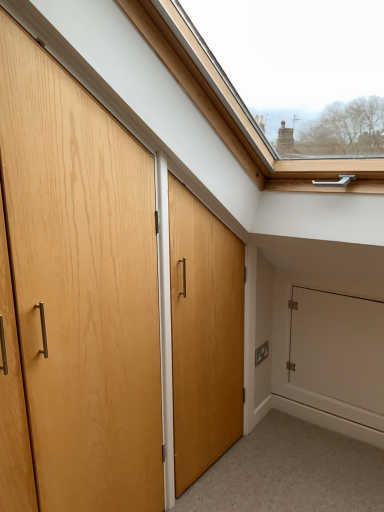
Describe the element at coordinates (337, 355) in the screenshot. I see `white matte door at lower right` at that location.

Image resolution: width=384 pixels, height=512 pixels. Identify the location of white matte door at lower right. (337, 355).

Describe the element at coordinates (81, 286) in the screenshot. I see `matte wood door at left` at that location.

This screenshot has height=512, width=384. In order to click on matte wood door at left in this screenshot , I will do `click(81, 286)`.

In order to click on white matte door at lower right in this screenshot , I will do `click(337, 355)`.

Is white matte door at lower right at the left side of matte wood door at left?

In fact, white matte door at lower right is to the right of matte wood door at left.

Between white matte door at lower right and matte wood door at left, which one is positioned behind?

white matte door at lower right.

Considering the points (306, 296) and (93, 364), which point is behind, point (306, 296) or point (93, 364)?

The point (306, 296) is farther.

From the image's perspective, between white matte door at lower right and matte wood door at left, who is located below?

white matte door at lower right appears lower in the image.

From a real-world perspective, is white matte door at lower right over matte wood door at left?

Actually, white matte door at lower right is physically below matte wood door at left in the real world.

Between white matte door at lower right and matte wood door at left, which one has larger width?

With larger width is matte wood door at left.

Between white matte door at lower right and matte wood door at left, which one has less height?

white matte door at lower right is shorter.

Considering the relative sizes of white matte door at lower right and matte wood door at left in the image provided, is white matte door at lower right bigger than matte wood door at left?

Actually, white matte door at lower right might be smaller than matte wood door at left.

Is white matte door at lower right surrounding matte wood door at left?

That's incorrect, matte wood door at left is not inside white matte door at lower right.

Is white matte door at lower right with matte wood door at left?

No, white matte door at lower right is not in contact with matte wood door at left.

Is white matte door at lower right facing towards matte wood door at left?

Yes, white matte door at lower right is oriented towards matte wood door at left.

Identify the location of screen door that is below the matte wood door at left (from the image's perspective). This screenshot has width=384, height=512. click(x=337, y=355).

In the scene shown: Would you say matte wood door at left is to the left or to the right of white matte door at lower right in the picture?

From the image, it's evident that matte wood door at left is to the left of white matte door at lower right.

Which object is closer to the camera, matte wood door at left or white matte door at lower right?

matte wood door at left is in front.

Which is in front, point (120, 291) or point (365, 355)?

The point (120, 291) is closer to the camera.

From the image's perspective, is matte wood door at left on top of white matte door at lower right?

Yes, from the image's perspective, matte wood door at left is above white matte door at lower right.

From a real-world perspective, who is located higher, matte wood door at left or white matte door at lower right?

matte wood door at left.

Considering the sizes of objects matte wood door at left and white matte door at lower right in the image provided, who is wider, matte wood door at left or white matte door at lower right?

matte wood door at left is wider.

Considering the relative sizes of matte wood door at left and white matte door at lower right in the image provided, is matte wood door at left shorter than white matte door at lower right?

No.

Between matte wood door at left and white matte door at lower right, which one has larger size?

matte wood door at left.

Can white matte door at lower right be found inside matte wood door at left?

No, white matte door at lower right is not inside matte wood door at left.

Is matte wood door at left far away from white matte door at lower right?

A: Absolutely, matte wood door at left is distant from white matte door at lower right.

Based on the photo, could you tell me if matte wood door at left is turned towards white matte door at lower right?

No, matte wood door at left is not oriented towards white matte door at lower right.

Measure the distance between matte wood door at left and white matte door at lower right.

matte wood door at left and white matte door at lower right are 1.21 meters apart.

Find the location of a particular element. This screenshot has width=384, height=512. door that is above the white matte door at lower right (from a real-world perspective) is located at coordinates (81, 286).

Image resolution: width=384 pixels, height=512 pixels. In order to click on door in front of the white matte door at lower right in this screenshot , I will do `click(81, 286)`.

Locate an element on the screen. The image size is (384, 512). door above the white matte door at lower right (from the image's perspective) is located at coordinates (81, 286).